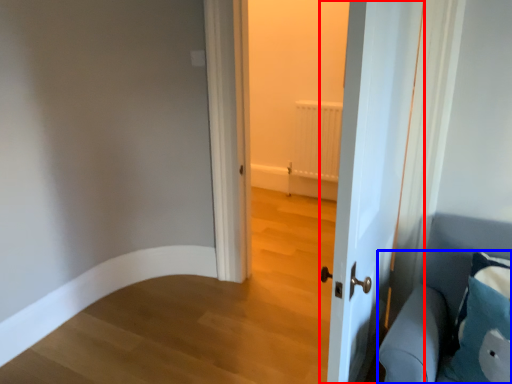
Question: Among these objects, which one is nearest to the camera, door (highlighted by a red box) or furniture (highlighted by a blue box)?

Choices:
 (A) door
 (B) furniture

Answer: (A)